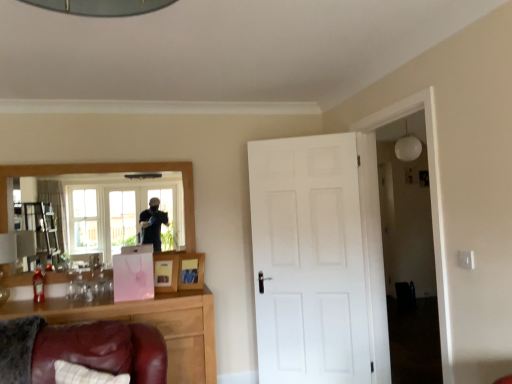
Question: Does white matte light fixture at upper right lie in front of pink paper picture frame at center, positioned as the second picture frame in right-to-left order?

Choices:
 (A) yes
 (B) no

Answer: (B)

Question: From the image's perspective, does white matte light fixture at upper right appear higher than pink paper picture frame at center, the 1th picture frame from the left?

Choices:
 (A) no
 (B) yes

Answer: (B)

Question: Is white matte light fixture at upper right turned away from pink paper picture frame at center, the 1th picture frame from the left?

Choices:
 (A) no
 (B) yes

Answer: (A)

Question: Could you tell me if white matte light fixture at upper right is turned towards pink paper picture frame at center, positioned as the second picture frame in right-to-left order?

Choices:
 (A) yes
 (B) no

Answer: (A)

Question: Does white matte light fixture at upper right have a lesser width compared to pink paper picture frame at center, positioned as the second picture frame in right-to-left order?

Choices:
 (A) yes
 (B) no

Answer: (B)

Question: Does white matte light fixture at upper right appear on the right side of pink paper picture frame at center, positioned as the second picture frame in right-to-left order?

Choices:
 (A) yes
 (B) no

Answer: (A)

Question: Does white matte light fixture at upper right have a greater width compared to wooden photo frame at center, the first picture frame viewed from the right?

Choices:
 (A) yes
 (B) no

Answer: (A)

Question: Is white matte light fixture at upper right not close to wooden photo frame at center, the first picture frame viewed from the right?

Choices:
 (A) yes
 (B) no

Answer: (A)

Question: Is white matte light fixture at upper right facing towards wooden photo frame at center, which is the second picture frame from left to right?

Choices:
 (A) no
 (B) yes

Answer: (B)

Question: From a real-world perspective, is white matte light fixture at upper right under wooden photo frame at center, the first picture frame viewed from the right?

Choices:
 (A) yes
 (B) no

Answer: (B)

Question: Is white matte light fixture at upper right turned away from wooden photo frame at center, which is the second picture frame from left to right?

Choices:
 (A) no
 (B) yes

Answer: (A)

Question: Are white matte light fixture at upper right and wooden photo frame at center, which is the second picture frame from left to right, beside each other?

Choices:
 (A) no
 (B) yes

Answer: (A)

Question: Is wooden photo frame at center, which is the second picture frame from left to right, closer to the viewer compared to wooden framed mirror at upper left?

Choices:
 (A) no
 (B) yes

Answer: (A)